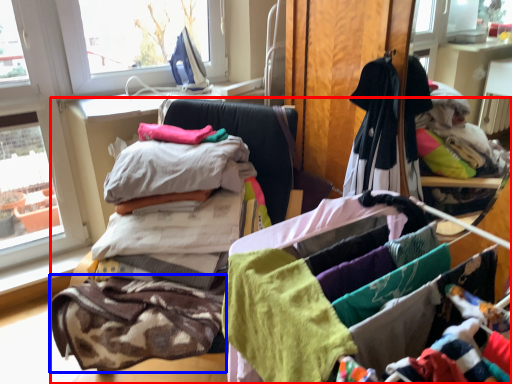
Question: Which object appears farthest to the camera in this image, furniture (highlighted by a red box) or baby clothe (highlighted by a blue box)?

Choices:
 (A) furniture
 (B) baby clothe

Answer: (B)